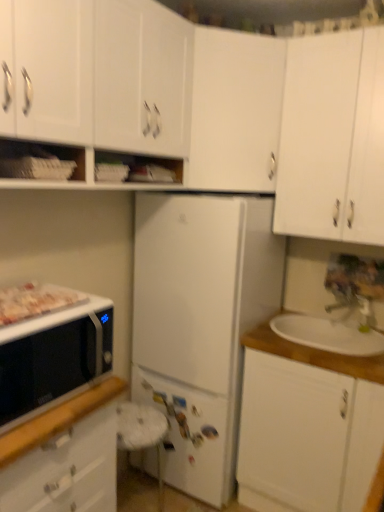
Locate an element on the screen. Image resolution: width=384 pixels, height=512 pixels. empty space that is ontop of white wood cabinet at right, placed as the fourth cabinetry when sorted from left to right (from a real-world perspective) is located at coordinates (333, 334).